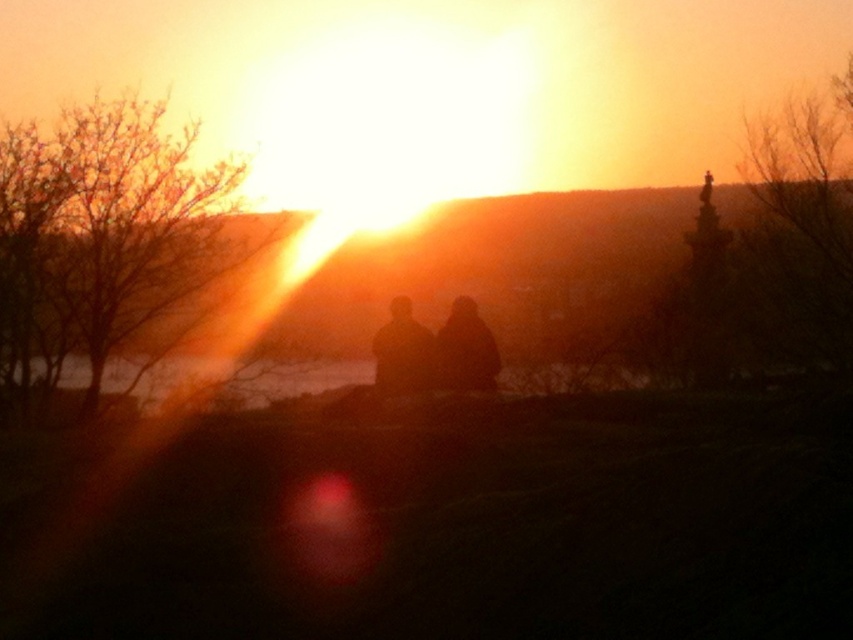
You are a photographer trying to capture the sunset scene. You need to ensure that the silhouette figures at center and the black matte figure at center are spaced appropriately in your shot. How far apart are these two figures in inches?

The silhouette figures at center is 14.00 inches from black matte figure at center.